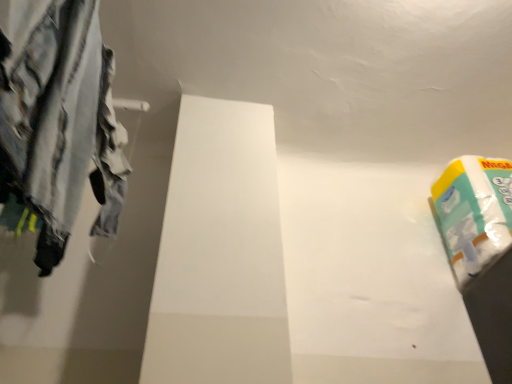
Question: Is white glossy toilet paper at upper right completely or partially inside striped cotton pants at left?

Choices:
 (A) yes
 (B) no

Answer: (B)

Question: Considering the relative positions of striped cotton pants at left and white glossy toilet paper at upper right in the image provided, is striped cotton pants at left to the right of white glossy toilet paper at upper right from the viewer's perspective?

Choices:
 (A) no
 (B) yes

Answer: (A)

Question: Is the depth of striped cotton pants at left less than that of white glossy toilet paper at upper right?

Choices:
 (A) no
 (B) yes

Answer: (B)

Question: Is striped cotton pants at left not inside white glossy toilet paper at upper right?

Choices:
 (A) no
 (B) yes

Answer: (B)

Question: Considering the relative sizes of striped cotton pants at left and white glossy toilet paper at upper right in the image provided, is striped cotton pants at left thinner than white glossy toilet paper at upper right?

Choices:
 (A) no
 (B) yes

Answer: (B)

Question: Considering the relative sizes of striped cotton pants at left and white glossy toilet paper at upper right in the image provided, is striped cotton pants at left smaller than white glossy toilet paper at upper right?

Choices:
 (A) yes
 (B) no

Answer: (A)

Question: Considering the relative sizes of white glossy toilet paper at upper right and striped cotton pants at left in the image provided, is white glossy toilet paper at upper right smaller than striped cotton pants at left?

Choices:
 (A) no
 (B) yes

Answer: (A)

Question: Does white glossy toilet paper at upper right have a greater width compared to striped cotton pants at left?

Choices:
 (A) no
 (B) yes

Answer: (B)

Question: Is white glossy toilet paper at upper right bigger than striped cotton pants at left?

Choices:
 (A) yes
 (B) no

Answer: (A)

Question: From a real-world perspective, is white glossy toilet paper at upper right under striped cotton pants at left?

Choices:
 (A) no
 (B) yes

Answer: (A)

Question: Is white glossy toilet paper at upper right touching striped cotton pants at left?

Choices:
 (A) no
 (B) yes

Answer: (A)

Question: Is white glossy toilet paper at upper right far from striped cotton pants at left?

Choices:
 (A) no
 (B) yes

Answer: (B)

Question: Looking at the image, does striped cotton pants at left seem bigger or smaller compared to white glossy toilet paper at upper right?

Choices:
 (A) small
 (B) big

Answer: (A)